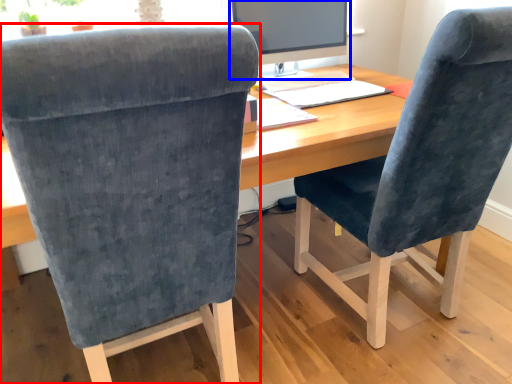
Question: Which of the following is the closest to the observer, chair (highlighted by a red box) or computer monitor (highlighted by a blue box)?

Choices:
 (A) chair
 (B) computer monitor

Answer: (A)